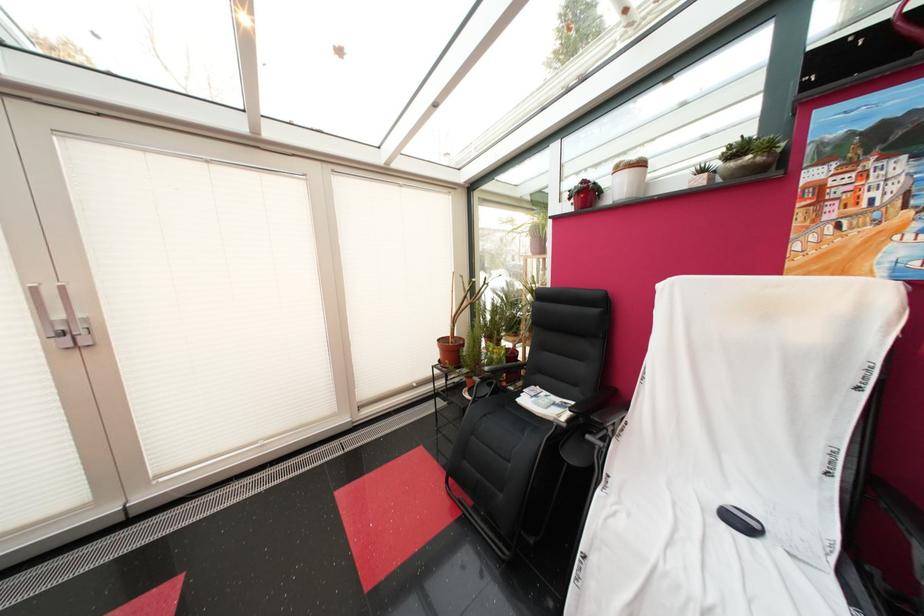
Find the location of a particular element. This screenshot has height=616, width=924. magazine on chair is located at coordinates (544, 405).